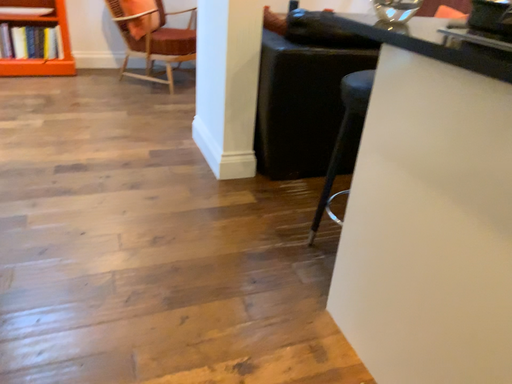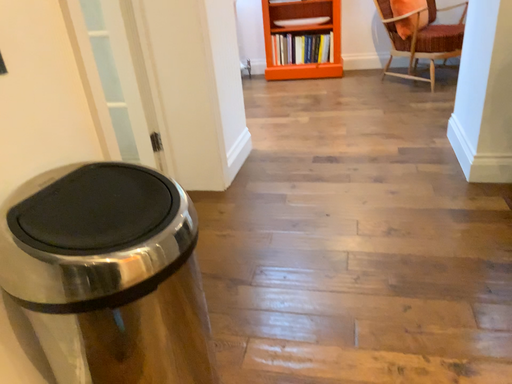
Question: Which way did the camera rotate in the video?

Choices:
 (A) rotated right
 (B) rotated left

Answer: (B)